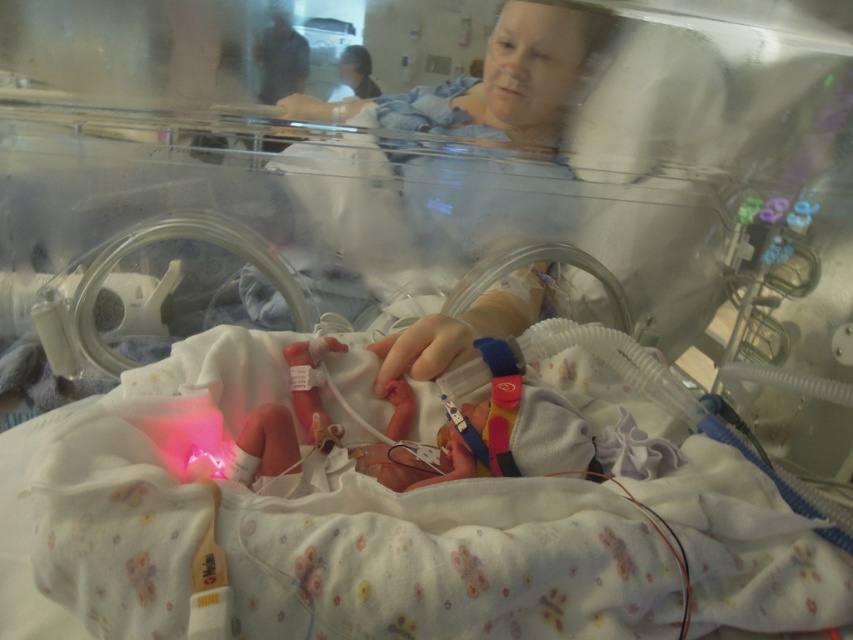
You are a nurse preparing to check the vital signs of the smooth skin newborn at center. You notice the matte blue gown at upper center hanging nearby. Given that your medical tools require 18 inches of space to operate effectively, do you have enough space between the newborn and the gown to perform the procedure?

The smooth skin newborn at center and the matte blue gown at upper center are 17.54 inches apart from each other. Since the required space is 18 inches, there is insufficient space to perform the procedure comfortably. You may need to adjust the gown or move it slightly to create more room.